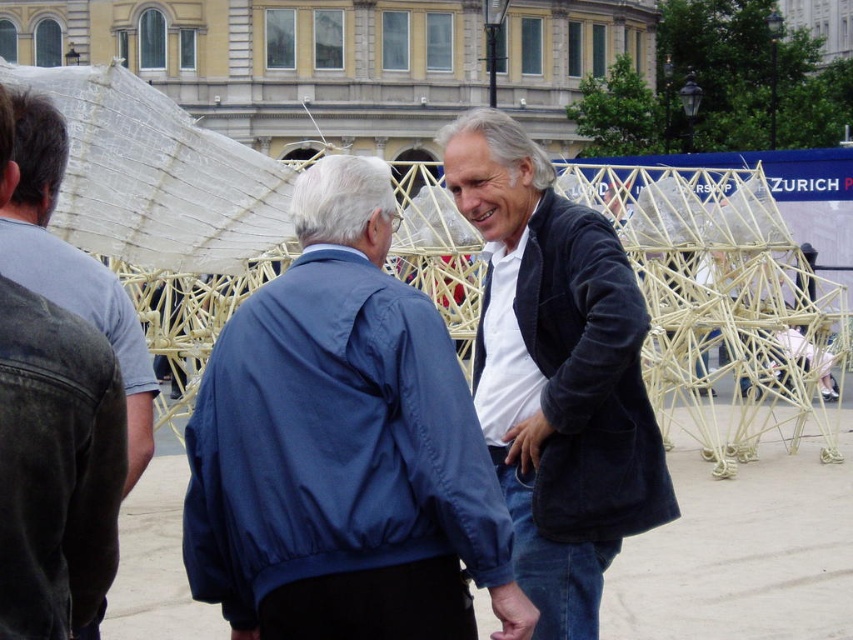
Is the position of blue fabric jacket at center more distant than that of velvet blue jacket at center?

No, it is in front of velvet blue jacket at center.

Between blue fabric jacket at center and velvet blue jacket at center, which one appears on the right side from the viewer's perspective?

Positioned to the right is velvet blue jacket at center.

Between point (213, 374) and point (500, 232), which one is positioned behind?

Point (500, 232)

Locate an element on the screen. The height and width of the screenshot is (640, 853). blue fabric jacket at center is located at coordinates [341, 445].

Is velvet blue jacket at center to the left of dark blue fabric jacket at lower left from the viewer's perspective?

Incorrect, velvet blue jacket at center is not on the left side of dark blue fabric jacket at lower left.

Identify the location of velvet blue jacket at center. Image resolution: width=853 pixels, height=640 pixels. (556, 372).

Locate an element on the screen. This screenshot has width=853, height=640. velvet blue jacket at center is located at coordinates (556, 372).

Is blue fabric jacket at center further to camera compared to denim jacket at left?

Yes, blue fabric jacket at center is further from the viewer.

Which is behind, point (370, 218) or point (88, 291)?

Positioned behind is point (88, 291).

In order to click on blue fabric jacket at center in this screenshot , I will do `click(341, 445)`.